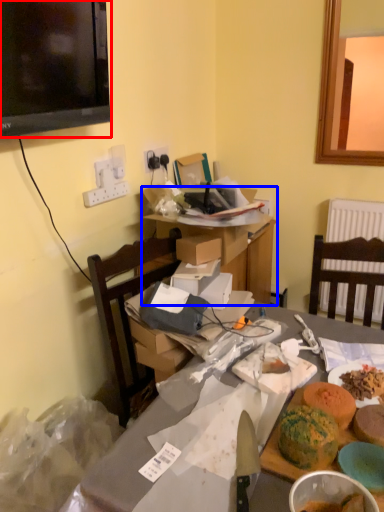
Question: Which point is further to the camera, television (highlighted by a red box) or table (highlighted by a blue box)?

Choices:
 (A) television
 (B) table

Answer: (B)